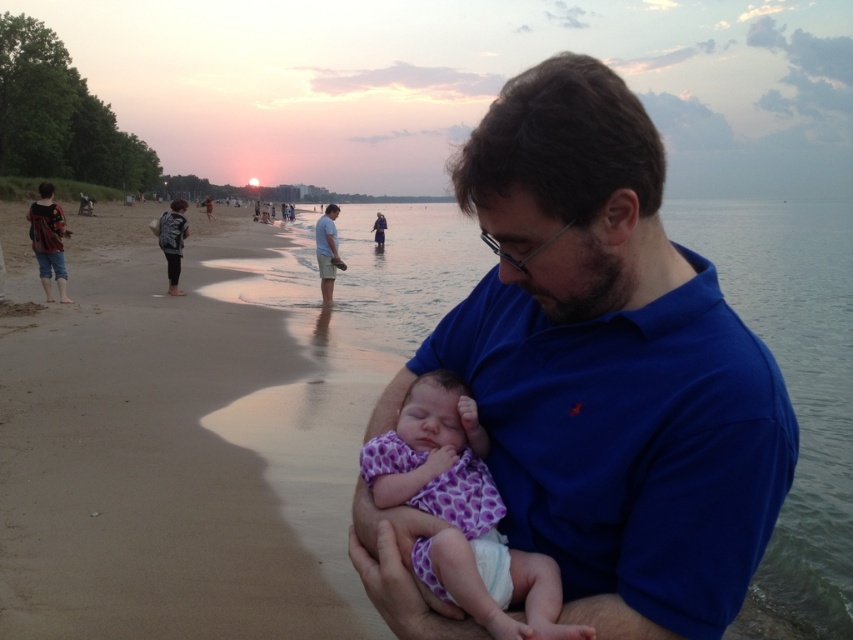
Does purple fabric baby at center have a greater height compared to light blue cotton shirt at center?

Incorrect, purple fabric baby at center's height is not larger of light blue cotton shirt at center's.

Which is below, purple fabric baby at center or light blue cotton shirt at center?

Positioned lower is purple fabric baby at center.

What do you see at coordinates (461, 513) in the screenshot? This screenshot has height=640, width=853. I see `purple fabric baby at center` at bounding box center [461, 513].

The width and height of the screenshot is (853, 640). I want to click on purple fabric baby at center, so click(x=461, y=513).

Which is more to the left, beige sand at center or light blue cotton shirt at center?

From the viewer's perspective, light blue cotton shirt at center appears more on the left side.

In order to click on beige sand at center in this screenshot , I will do `click(206, 422)`.

Which is above, blue cotton shirt at center or purple fabric baby at center?

blue cotton shirt at center is above.

Is blue cotton shirt at center positioned at the back of purple fabric baby at center?

That is True.

Which is behind, point (482, 124) or point (413, 499)?

Positioned behind is point (413, 499).

At what (x,y) coordinates should I click in order to perform the action: click on blue cotton shirt at center. Please return your answer as a coordinate pair (x, y). This screenshot has height=640, width=853. Looking at the image, I should click on (608, 365).